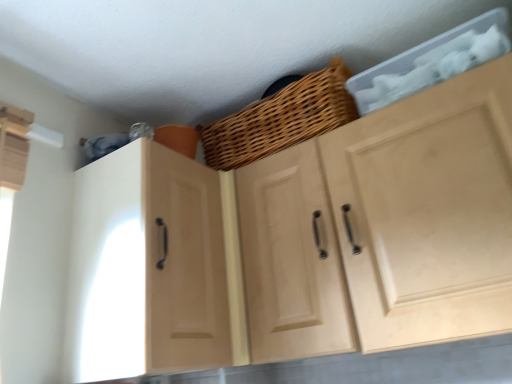
Question: From a real-world perspective, relative to woven wood basket at upper center, is matte wood cabinet at left, positioned as the first cabinetry in left-to-right order, vertically above or below?

Choices:
 (A) below
 (B) above

Answer: (A)

Question: Is matte wood cabinet at left, positioned as the first cabinetry in left-to-right order, in front of or behind woven wood basket at upper center in the image?

Choices:
 (A) front
 (B) behind

Answer: (A)

Question: Which is nearer to the natural wood cabinet at upper center, the 2th cabinetry viewed from the left?

Choices:
 (A) matte wood cabinet at left, positioned as the first cabinetry in left-to-right order
 (B) woven wood basket at upper center

Answer: (B)

Question: Considering the real-world distances, which object is closest to the woven wood basket at upper center?

Choices:
 (A) natural wood cabinet at upper center, the 2th cabinetry viewed from the left
 (B) matte wood cabinet at left, positioned as the first cabinetry in left-to-right order

Answer: (A)